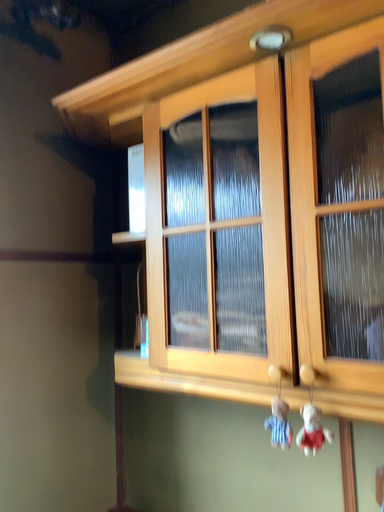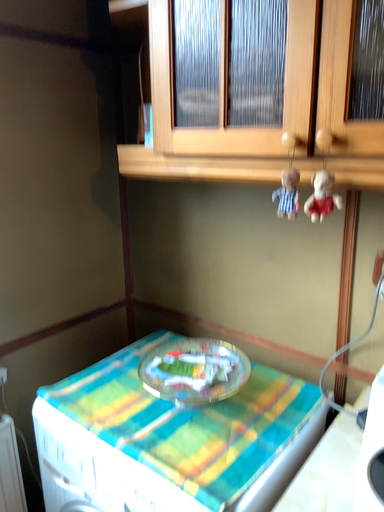
Question: Which way did the camera rotate in the video?

Choices:
 (A) rotated downward
 (B) rotated upward

Answer: (A)